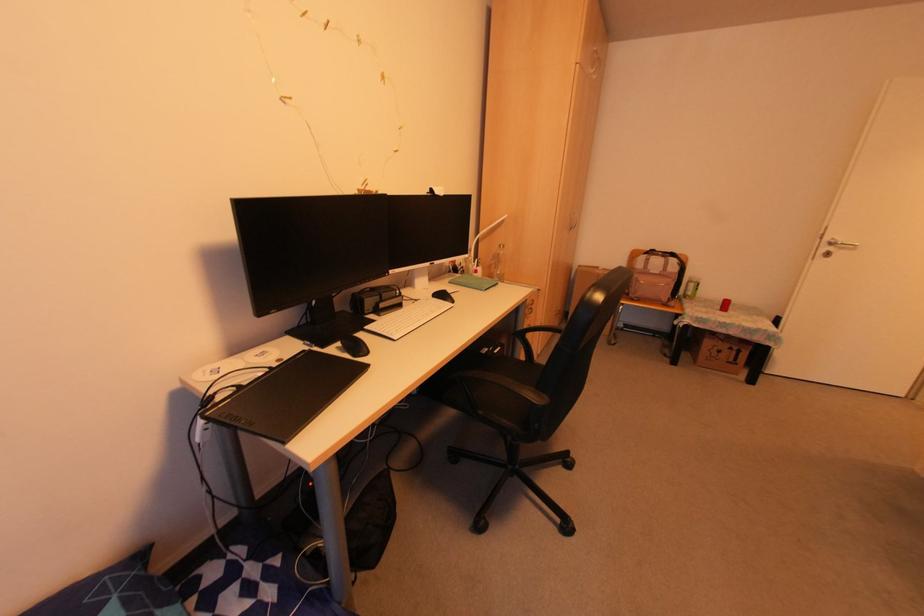
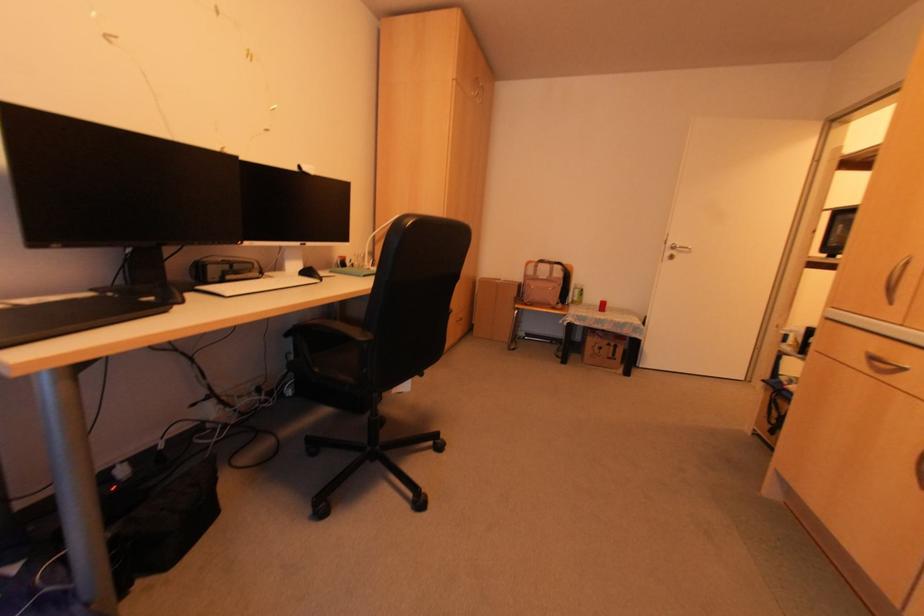
In the second image, find the point that corresponds to point 832,238 in the first image.

(671, 245)